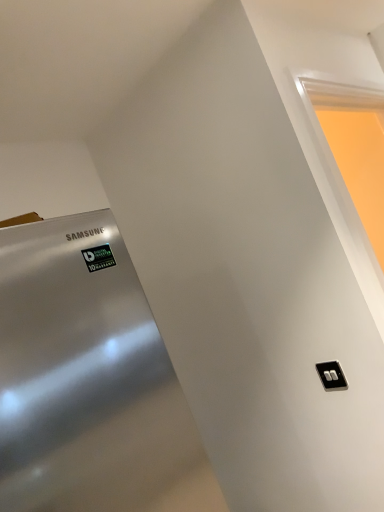
Question: Can you see matte white frame at upper right touching black plastic/light switch at lower right?

Choices:
 (A) no
 (B) yes

Answer: (A)

Question: Considering the relative sizes of matte white frame at upper right and black plastic/light switch at lower right in the image provided, is matte white frame at upper right bigger than black plastic/light switch at lower right?

Choices:
 (A) no
 (B) yes

Answer: (B)

Question: Can you confirm if matte white frame at upper right is thinner than black plastic/light switch at lower right?

Choices:
 (A) no
 (B) yes

Answer: (A)

Question: From a real-world perspective, is matte white frame at upper right physically below black plastic/light switch at lower right?

Choices:
 (A) no
 (B) yes

Answer: (A)

Question: Could you tell me if matte white frame at upper right is turned towards black plastic/light switch at lower right?

Choices:
 (A) yes
 (B) no

Answer: (B)

Question: Does matte white frame at upper right have a lesser height compared to black plastic/light switch at lower right?

Choices:
 (A) no
 (B) yes

Answer: (A)

Question: From a real-world perspective, is black plastic/light switch at lower right physically below matte white frame at upper right?

Choices:
 (A) no
 (B) yes

Answer: (B)

Question: From the image's perspective, does black plastic/light switch at lower right appear higher than matte white frame at upper right?

Choices:
 (A) no
 (B) yes

Answer: (A)

Question: Is black plastic/light switch at lower right completely or partially outside of matte white frame at upper right?

Choices:
 (A) yes
 (B) no

Answer: (A)

Question: Are black plastic/light switch at lower right and matte white frame at upper right beside each other?

Choices:
 (A) yes
 (B) no

Answer: (B)

Question: Does black plastic/light switch at lower right appear on the left side of matte white frame at upper right?

Choices:
 (A) yes
 (B) no

Answer: (A)

Question: Considering the relative sizes of black plastic/light switch at lower right and matte white frame at upper right in the image provided, is black plastic/light switch at lower right taller than matte white frame at upper right?

Choices:
 (A) yes
 (B) no

Answer: (B)

Question: From their relative heights in the image, would you say matte white frame at upper right is taller or shorter than black plastic/light switch at lower right?

Choices:
 (A) tall
 (B) short

Answer: (A)